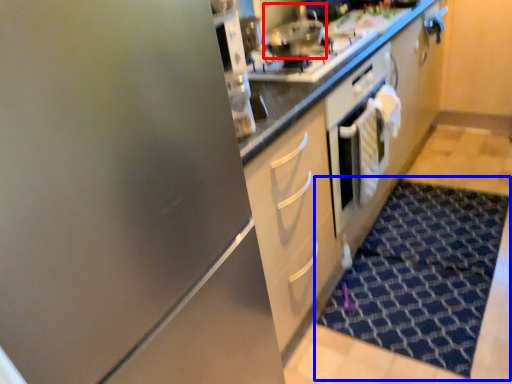
Question: Among these objects, which one is nearest to the camera, stainless steel (highlighted by a red box) or doormat (highlighted by a blue box)?

Choices:
 (A) stainless steel
 (B) doormat

Answer: (B)